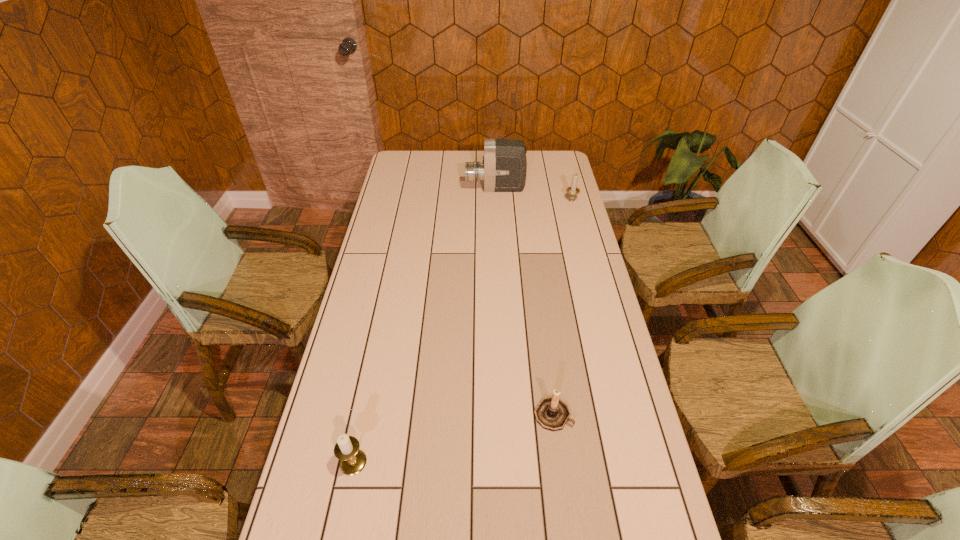
Locate an element on the screen. camcorder is located at coordinates (504, 167).

At what (x,y) coordinates should I click in order to perform the action: click on the farthest candle holder. Please return your answer as a coordinate pair (x, y). The height and width of the screenshot is (540, 960). Looking at the image, I should click on (572, 191).

What are the coordinates of `the rightmost candle holder` in the screenshot? It's located at (572, 191).

Where is `the leftmost object`? Image resolution: width=960 pixels, height=540 pixels. the leftmost object is located at coordinates (352, 460).

This screenshot has height=540, width=960. Find the location of `the leftmost candle holder`. the leftmost candle holder is located at coordinates (352, 460).

Locate an element on the screen. This screenshot has width=960, height=540. the second farthest candle holder is located at coordinates (552, 413).

Locate an element on the screen. The height and width of the screenshot is (540, 960). the second candle holder from left to right is located at coordinates (552, 413).

This screenshot has height=540, width=960. In order to click on free region located at the front of the tallest object, highlighting the lens in this screenshot , I will do `click(405, 188)`.

Find the location of a particular element. free region located at the front of the tallest object, highlighting the lens is located at coordinates (448, 188).

Find the location of a particular element. The width and height of the screenshot is (960, 540). vacant space located 0.340m at the front of the tallest object, highlighting the lens is located at coordinates (393, 188).